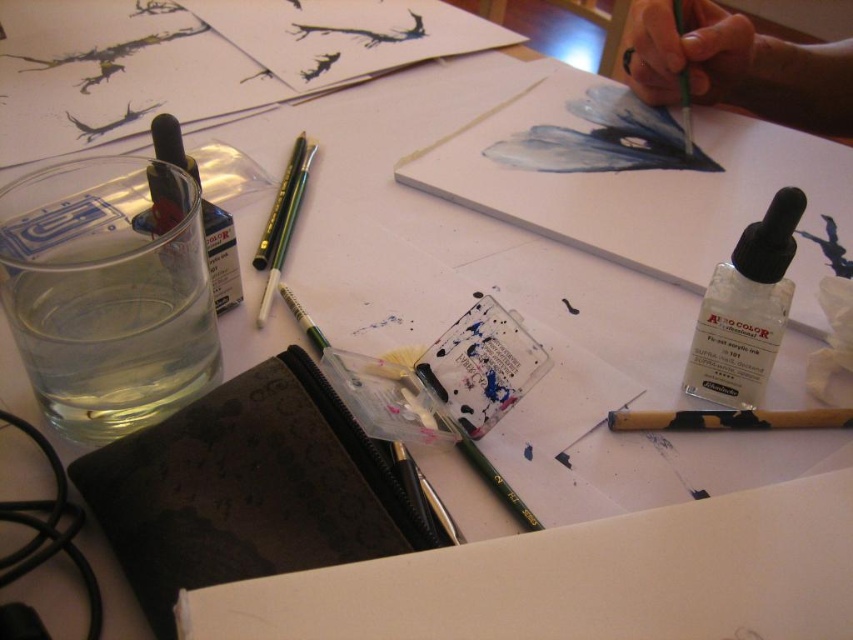
Question: Is transparent glass at left bigger than smooth blue feather at upper right?

Choices:
 (A) yes
 (B) no

Answer: (B)

Question: Which of the following is the farthest from the observer?

Choices:
 (A) (206, 211)
 (B) (831, 72)

Answer: (B)

Question: Is transparent glass at left bigger than green paintbrush at upper right?

Choices:
 (A) yes
 (B) no

Answer: (B)

Question: Considering the relative positions of green paintbrush at upper right and clear plastic bottle at center-right in the image provided, where is green paintbrush at upper right located with respect to clear plastic bottle at center-right?

Choices:
 (A) below
 (B) above

Answer: (B)

Question: Which point is farther to the camera?

Choices:
 (A) transparent plastic bottle at upper left
 (B) green paintbrush at upper right
 (C) transparent glass at left

Answer: (B)

Question: Which of the following is the closest to the observer?

Choices:
 (A) (769, 364)
 (B) (834, 106)
 (C) (207, 204)

Answer: (A)